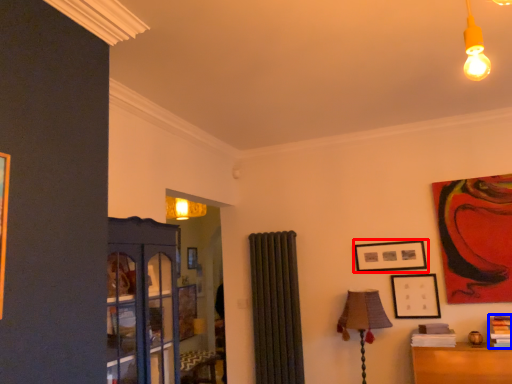
Question: Which of the following is the farthest to the observer, picture frame (highlighted by a red box) or book (highlighted by a blue box)?

Choices:
 (A) picture frame
 (B) book

Answer: (A)